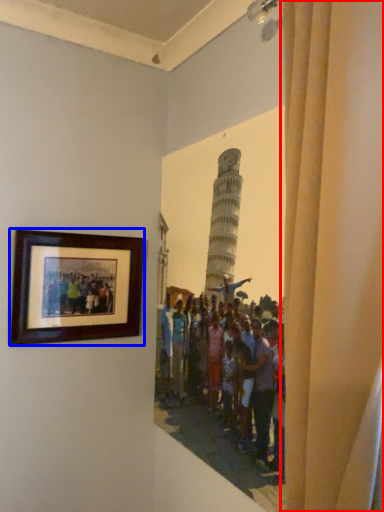
Question: Which object appears farthest to the camera in this image, curtain (highlighted by a red box) or picture frame (highlighted by a blue box)?

Choices:
 (A) curtain
 (B) picture frame

Answer: (B)